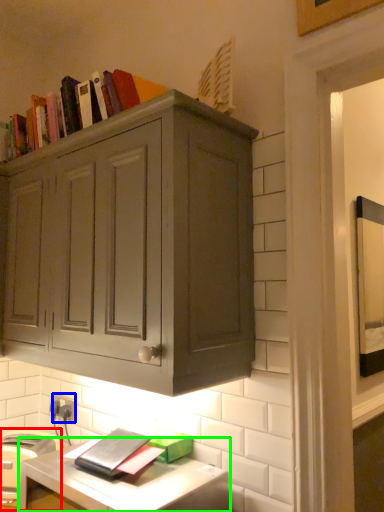
Question: Based on their relative distances, which object is farther from appliance (highlighted by a red box)? Choose from electric outlet (highlighted by a blue box) and computer desk (highlighted by a green box).

Choices:
 (A) electric outlet
 (B) computer desk

Answer: (A)